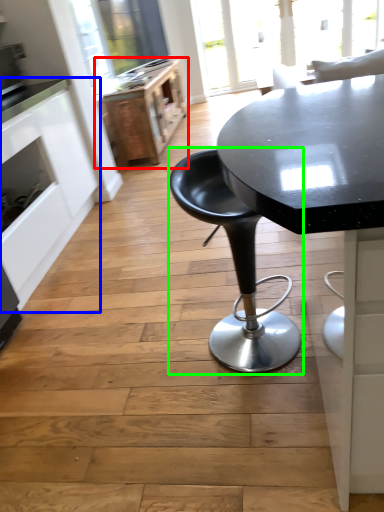
Question: Based on their relative distances, which object is farther from file cabinet (highlighted by a red box)? Choose from cabinetry (highlighted by a blue box) and chair (highlighted by a green box).

Choices:
 (A) cabinetry
 (B) chair

Answer: (B)